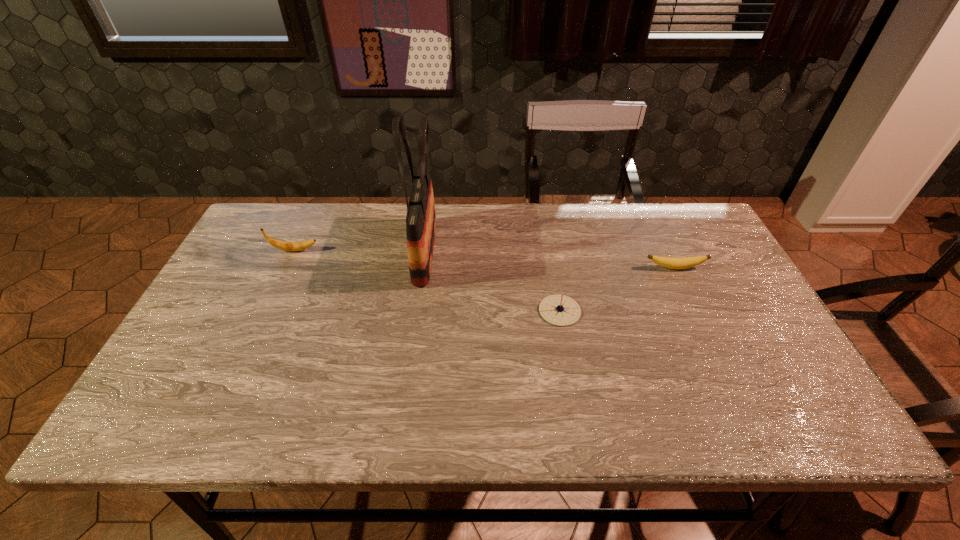
Where is `free spot that satisfies the following two spatial constraints: 1. on the back side of the nearest object; 2. on the right side of the right banana`? The width and height of the screenshot is (960, 540). free spot that satisfies the following two spatial constraints: 1. on the back side of the nearest object; 2. on the right side of the right banana is located at coordinates click(x=552, y=268).

You are a GUI agent. You are given a task and a screenshot of the screen. Output one action in this format:
    pyautogui.click(x=<x>, y=<y>)
    Task: Click on the free space that satisfies the following two spatial constraints: 1. on the peel of the rightmost object from the top; 2. on the left side of the second tallest object
    The width and height of the screenshot is (960, 540).
    Given the screenshot: What is the action you would take?
    pyautogui.click(x=286, y=268)

Where is `vacant space that satisfies the following two spatial constraints: 1. on the peel of the shortest object from the top; 2. on the left side of the second tallest object`? Image resolution: width=960 pixels, height=540 pixels. vacant space that satisfies the following two spatial constraints: 1. on the peel of the shortest object from the top; 2. on the left side of the second tallest object is located at coordinates (286, 268).

Locate an element on the screen. The height and width of the screenshot is (540, 960). vacant space that satisfies the following two spatial constraints: 1. on the peel of the left banana from the top; 2. on the back side of the compass is located at coordinates (266, 310).

The height and width of the screenshot is (540, 960). In order to click on vacant space that satisfies the following two spatial constraints: 1. on the front-facing side of the shopping bag; 2. on the back side of the compass in this screenshot , I will do `click(417, 310)`.

Locate an element on the screen. This screenshot has width=960, height=540. free space that satisfies the following two spatial constraints: 1. on the front-facing side of the rightmost object; 2. on the left side of the tallest object is located at coordinates (422, 268).

Find the location of a particular element. The image size is (960, 540). vacant space that satisfies the following two spatial constraints: 1. on the back side of the compass; 2. on the right side of the nearer banana is located at coordinates (552, 268).

Where is `free space that satisfies the following two spatial constraints: 1. on the back side of the shorter banana; 2. on the peel of the farther banana from the top`? free space that satisfies the following two spatial constraints: 1. on the back side of the shorter banana; 2. on the peel of the farther banana from the top is located at coordinates (667, 251).